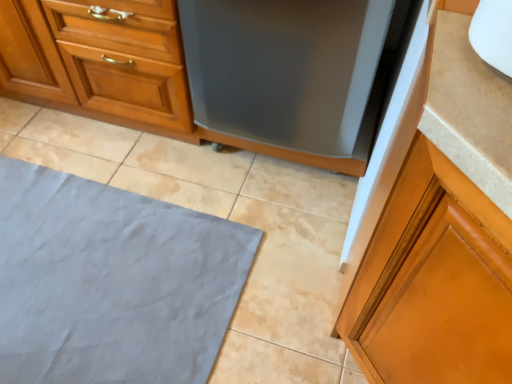
Question: Is satin black dishwasher at center at the right side of gray fabric bath mat at lower left?

Choices:
 (A) yes
 (B) no

Answer: (A)

Question: Considering the relative sizes of satin black dishwasher at center and gray fabric bath mat at lower left in the image provided, is satin black dishwasher at center wider than gray fabric bath mat at lower left?

Choices:
 (A) yes
 (B) no

Answer: (B)

Question: Does satin black dishwasher at center come behind gray fabric bath mat at lower left?

Choices:
 (A) no
 (B) yes

Answer: (A)

Question: From the image's perspective, is satin black dishwasher at center above gray fabric bath mat at lower left?

Choices:
 (A) no
 (B) yes

Answer: (B)

Question: Is satin black dishwasher at center oriented towards gray fabric bath mat at lower left?

Choices:
 (A) no
 (B) yes

Answer: (B)

Question: Is satin black dishwasher at center thinner than gray fabric bath mat at lower left?

Choices:
 (A) no
 (B) yes

Answer: (B)

Question: Is glossy wood cabinet at right, placed as the 2th cabinetry when sorted from top to bottom, facing towards satin black dishwasher at center?

Choices:
 (A) yes
 (B) no

Answer: (B)

Question: Considering the relative sizes of glossy wood cabinet at right, placed as the 2th cabinetry when sorted from top to bottom, and satin black dishwasher at center in the image provided, is glossy wood cabinet at right, placed as the 2th cabinetry when sorted from top to bottom, shorter than satin black dishwasher at center?

Choices:
 (A) no
 (B) yes

Answer: (A)

Question: Is glossy wood cabinet at right, the first cabinetry positioned from the front, not within satin black dishwasher at center?

Choices:
 (A) no
 (B) yes

Answer: (B)

Question: Is glossy wood cabinet at right, the 1th cabinetry positioned from the bottom, facing away from satin black dishwasher at center?

Choices:
 (A) no
 (B) yes

Answer: (A)

Question: Is glossy wood cabinet at right, placed as the 2th cabinetry when sorted from top to bottom, bigger than satin black dishwasher at center?

Choices:
 (A) no
 (B) yes

Answer: (A)

Question: From the image's perspective, is glossy wood cabinet at right, positioned as the 1th cabinetry in right-to-left order, over satin black dishwasher at center?

Choices:
 (A) yes
 (B) no

Answer: (B)

Question: Does wooden cabinet at center, arranged as the 2th cabinetry when viewed from the right, have a greater width compared to glossy wood cabinet at right, placed as the 2th cabinetry when sorted from top to bottom?

Choices:
 (A) yes
 (B) no

Answer: (A)